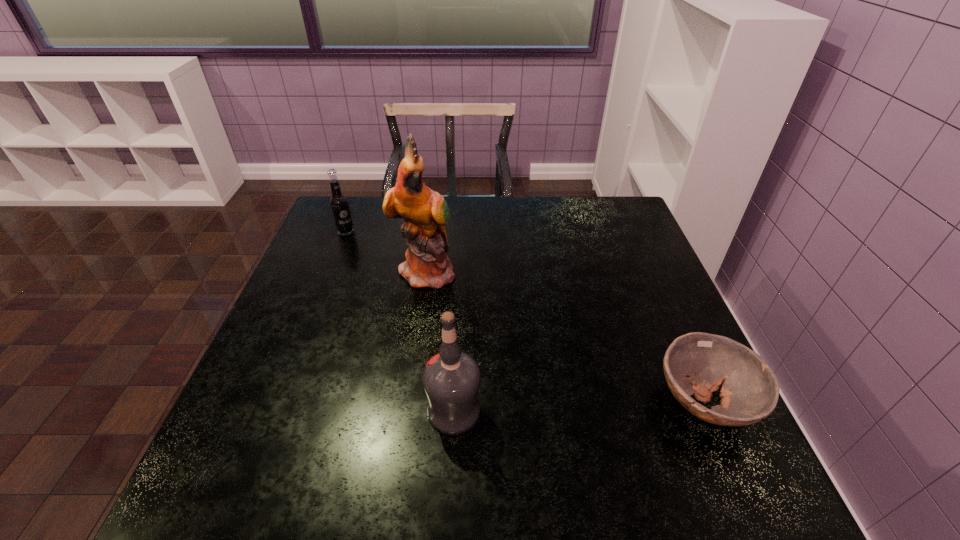
This screenshot has height=540, width=960. I want to click on vacant space located on the left of the rightmost object, so click(492, 402).

Identify the location of free region located on the front-facing side of the tallest object. (572, 383).

I want to click on vacant space situated on the front-facing side of the tallest object, so click(x=478, y=312).

Locate an element on the screen. This screenshot has width=960, height=540. free point located on the front-facing side of the tallest object is located at coordinates (469, 306).

Where is `vacant region located on the label of the leftmost object`? vacant region located on the label of the leftmost object is located at coordinates (383, 264).

At what (x,y) coordinates should I click in order to perform the action: click on free space located 0.210m on the label of the leftmost object. Please return your answer as a coordinate pair (x, y). Looking at the image, I should click on (389, 269).

What are the coordinates of `free region located 0.150m on the label of the leftmost object` in the screenshot? It's located at (377, 259).

Find the location of a particular element. Image resolution: width=960 pixels, height=540 pixels. object that is at the far edge is located at coordinates (339, 204).

This screenshot has height=540, width=960. I want to click on vodka that is at the near edge, so click(x=451, y=379).

Find the location of a particular element. The height and width of the screenshot is (540, 960). bowl at the near edge is located at coordinates (697, 363).